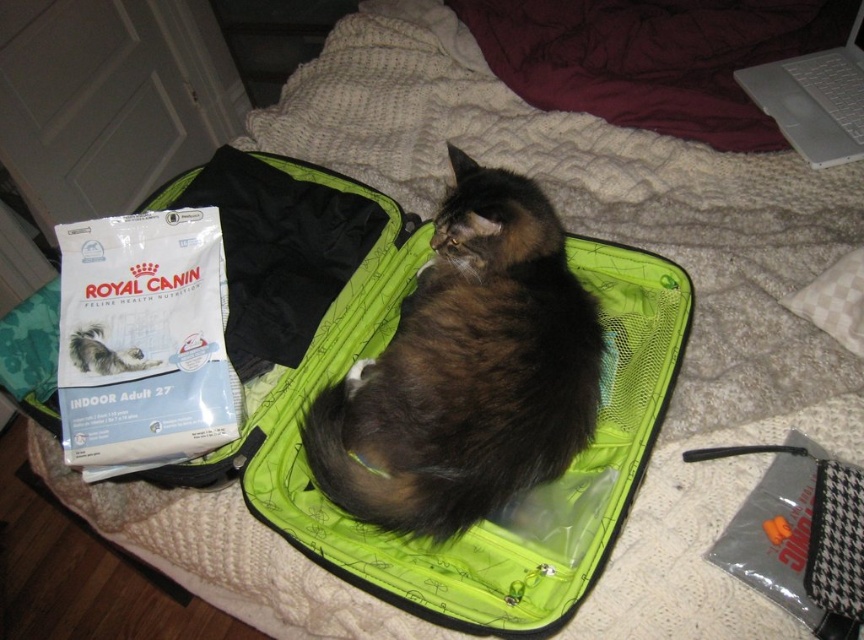
Question: Which of the following is the closest to the observer?

Choices:
 (A) (805, 120)
 (B) (386, 397)

Answer: (B)

Question: Does brown fluffy cat at center appear on the right side of white plastic laptop at upper right?

Choices:
 (A) yes
 (B) no

Answer: (B)

Question: Which point is farther from the camera taking this photo?

Choices:
 (A) (566, 275)
 (B) (759, 88)

Answer: (B)

Question: Can you confirm if brown fluffy cat at center is positioned to the left of white plastic laptop at upper right?

Choices:
 (A) no
 (B) yes

Answer: (B)

Question: Among these objects, which one is farthest from the camera?

Choices:
 (A) white plastic laptop at upper right
 (B) brown fluffy cat at center

Answer: (A)

Question: Can you confirm if brown fluffy cat at center is positioned above white plastic laptop at upper right?

Choices:
 (A) yes
 (B) no

Answer: (B)